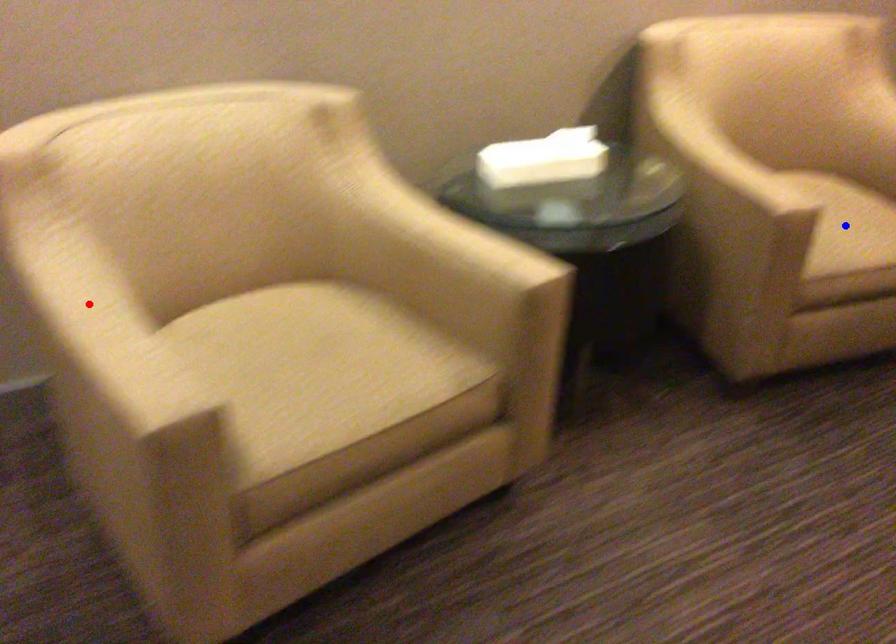
Question: Which of the two points in the image is closer to the camera?

Choices:
 (A) Blue point is closer.
 (B) Red point is closer.

Answer: (B)